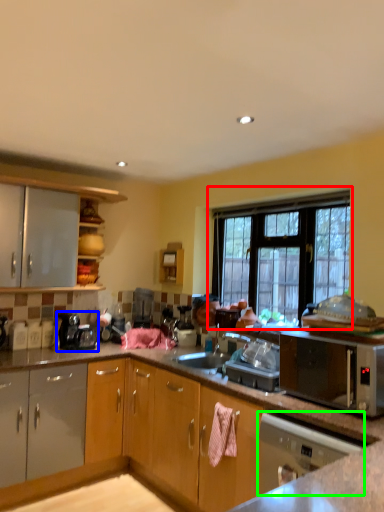
Question: Estimate the real-world distances between objects in this image. Which object is closer to window (highlighted by a red box), coffee machine (highlighted by a blue box) or home appliance (highlighted by a green box)?

Choices:
 (A) coffee machine
 (B) home appliance

Answer: (B)